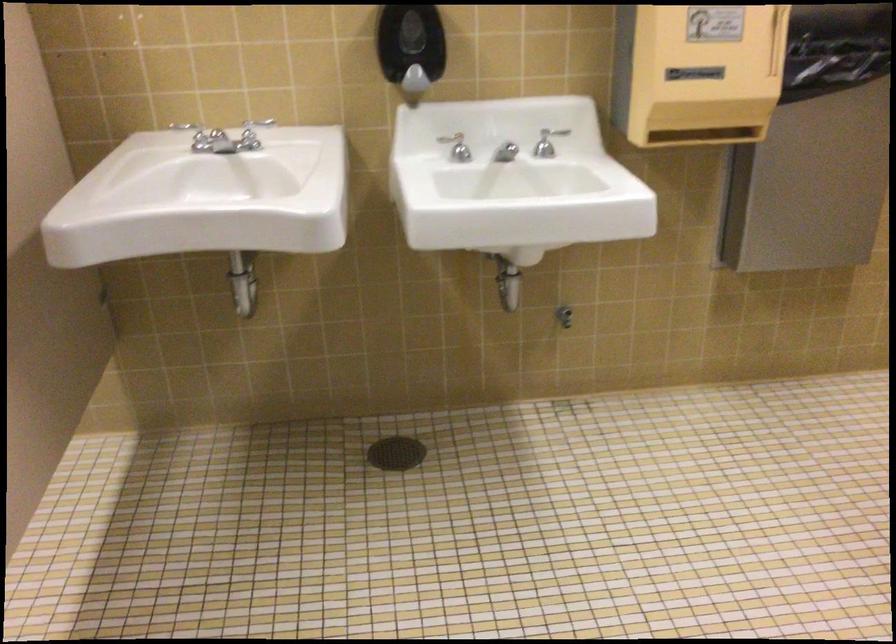
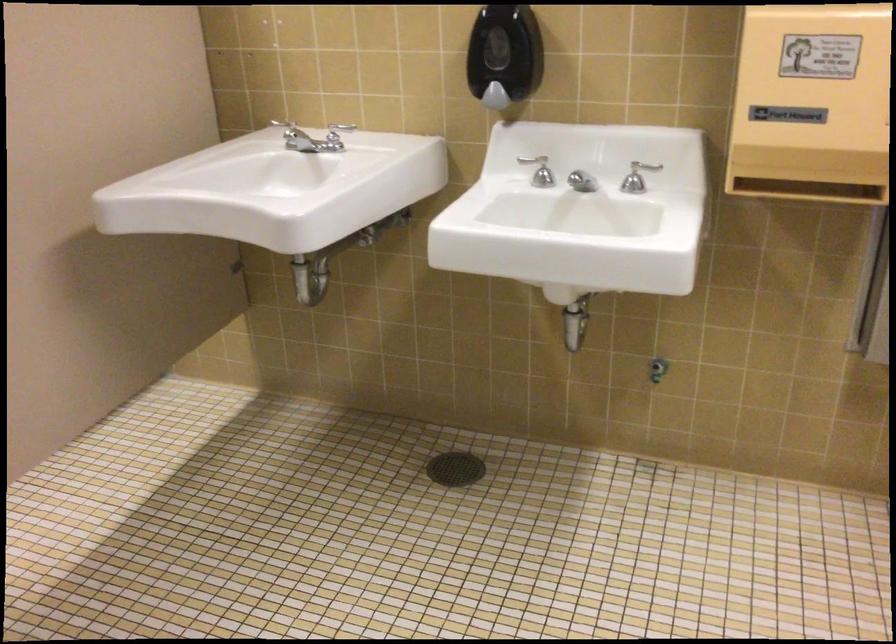
Question: The images are taken continuously from a first-person perspective. In which direction are you moving?

Choices:
 (A) Left
 (B) Right
 (C) Forward
 (D) Backward

Answer: (B)